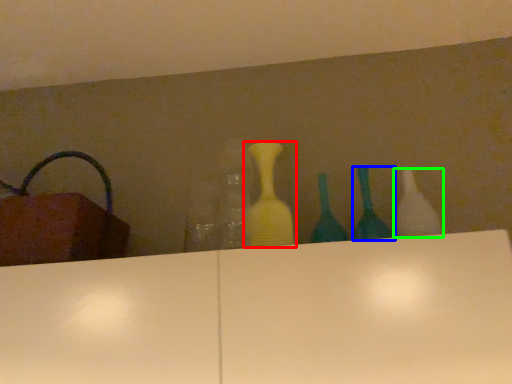
Question: Estimate the real-world distances between objects in this image. Which object is farther from bottle (highlighted by a red box), bottle (highlighted by a blue box) or bottle (highlighted by a green box)?

Choices:
 (A) bottle
 (B) bottle

Answer: (B)